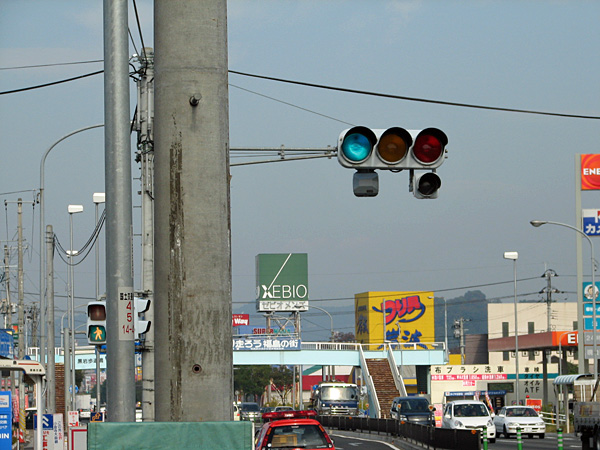
I want to click on stairs, so click(x=380, y=371).